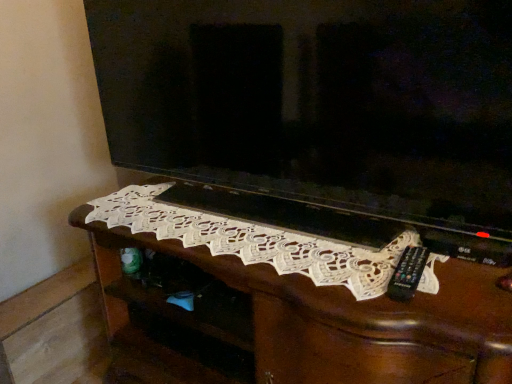
Question: Can you confirm if white lace doily at center is shorter than matte black television at center?

Choices:
 (A) no
 (B) yes

Answer: (A)

Question: From a real-world perspective, is white lace doily at center physically above matte black television at center?

Choices:
 (A) no
 (B) yes

Answer: (A)

Question: From the image's perspective, is white lace doily at center under matte black television at center?

Choices:
 (A) no
 (B) yes

Answer: (B)

Question: Is white lace doily at center oriented away from matte black television at center?

Choices:
 (A) no
 (B) yes

Answer: (A)

Question: Can you confirm if white lace doily at center is positioned to the right of matte black television at center?

Choices:
 (A) no
 (B) yes

Answer: (B)

Question: Is white lace doily at center bigger or smaller than white lace doily at center?

Choices:
 (A) big
 (B) small

Answer: (B)

Question: In terms of width, does white lace doily at center look wider or thinner when compared to white lace doily at center?

Choices:
 (A) wide
 (B) thin

Answer: (B)

Question: From the image's perspective, is white lace doily at center above or below white lace doily at center?

Choices:
 (A) above
 (B) below

Answer: (A)

Question: In terms of height, does white lace doily at center look taller or shorter compared to white lace doily at center?

Choices:
 (A) tall
 (B) short

Answer: (B)

Question: Is white lace doily at center bigger or smaller than white lace doily at center?

Choices:
 (A) big
 (B) small

Answer: (A)

Question: Based on their positions, is white lace doily at center located to the left or right of white lace doily at center?

Choices:
 (A) left
 (B) right

Answer: (B)

Question: Considering the positions of white lace doily at center and white lace doily at center in the image, is white lace doily at center taller or shorter than white lace doily at center?

Choices:
 (A) short
 (B) tall

Answer: (B)

Question: Is point (433, 264) positioned closer to the camera than point (315, 273)?

Choices:
 (A) closer
 (B) farther

Answer: (B)

Question: Does point [x=314, y=127] appear closer or farther from the camera than point [x=269, y=296]?

Choices:
 (A) farther
 (B) closer

Answer: (A)

Question: Do you think matte black television at center is within white lace doily at center, or outside of it?

Choices:
 (A) inside
 (B) outside

Answer: (B)